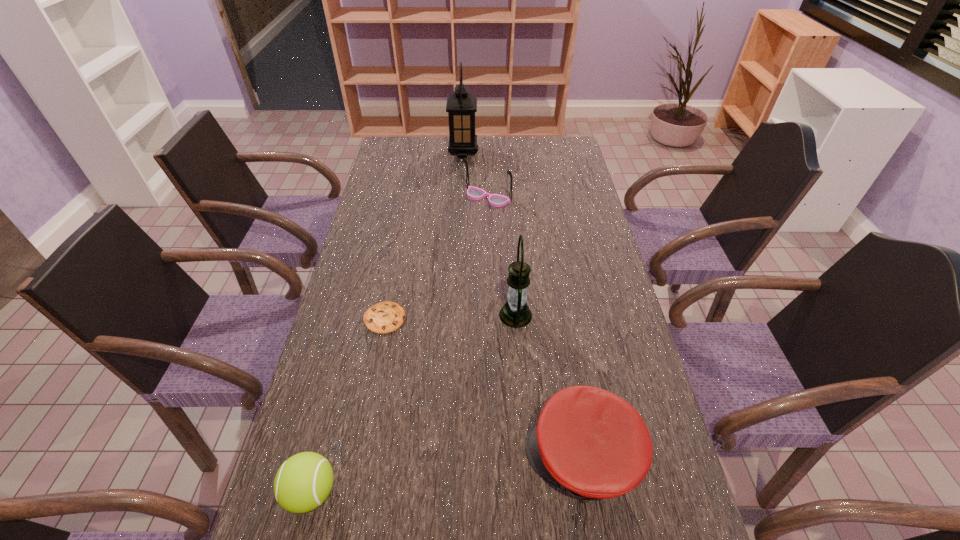
Identify the location of vacant region located on the side where the right lantern emits light. Image resolution: width=960 pixels, height=540 pixels. (481, 315).

This screenshot has width=960, height=540. Find the location of `vacant region located on the side where the right lantern emits light`. vacant region located on the side where the right lantern emits light is located at coordinates (455, 315).

I want to click on blank space located on the side where the right lantern emits light, so click(x=359, y=315).

Where is `blank area located 0.310m on the left of the spectacles`? This screenshot has height=540, width=960. blank area located 0.310m on the left of the spectacles is located at coordinates (375, 198).

This screenshot has height=540, width=960. In order to click on vacant space located on the front of the cap with an emblem in this screenshot , I will do `click(468, 458)`.

Identify the location of vacant space situated on the front of the cap with an emblem. (454, 458).

In order to click on vacant area situated 0.320m on the front of the cap with an emblem in this screenshot , I will do `click(373, 458)`.

Image resolution: width=960 pixels, height=540 pixels. Find the location of `blank area located 0.240m on the right of the tennis ball`. blank area located 0.240m on the right of the tennis ball is located at coordinates (459, 492).

This screenshot has width=960, height=540. I want to click on free space located 0.170m on the back of the cookie, so [x=396, y=262].

The width and height of the screenshot is (960, 540). In order to click on object that is at the far edge in this screenshot , I will do coord(461,106).